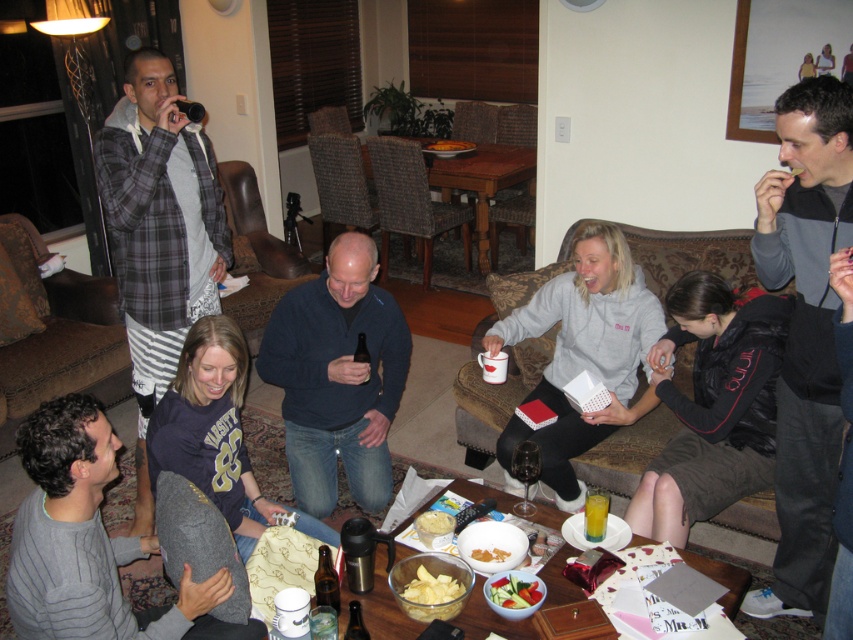
Question: Which of the following is the closest to the observer?

Choices:
 (A) (590, 492)
 (B) (190, 634)
 (C) (666, 461)

Answer: (B)

Question: Does translucent glass at lower center have a larger size compared to yellowish matte bowl at lower center?

Choices:
 (A) yes
 (B) no

Answer: (A)

Question: Which point is farther from the camera taking this photo?

Choices:
 (A) (149, 56)
 (B) (840, 436)
 (C) (376, 509)
 (D) (363, 333)

Answer: (C)

Question: Can you confirm if dark blue sweater at center is thinner than navy blue jersey at center?

Choices:
 (A) no
 (B) yes

Answer: (B)

Question: Which object is positioned closest to the yellowish matte bowl at center?

Choices:
 (A) gray sweater at lower left
 (B) dark blue sweater at center

Answer: (B)

Question: Does yellowish matte bowl at lower center have a larger size compared to brown glass beer at center?

Choices:
 (A) yes
 (B) no

Answer: (B)